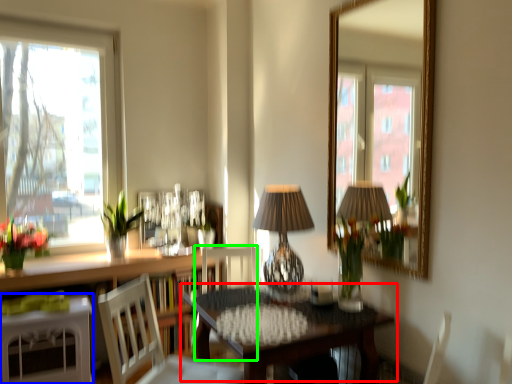
Question: Estimate the real-world distances between objects in this image. Which object is closer to table (highlighted by a red box), table (highlighted by a blue box) or chair (highlighted by a green box)?

Choices:
 (A) table
 (B) chair

Answer: (B)